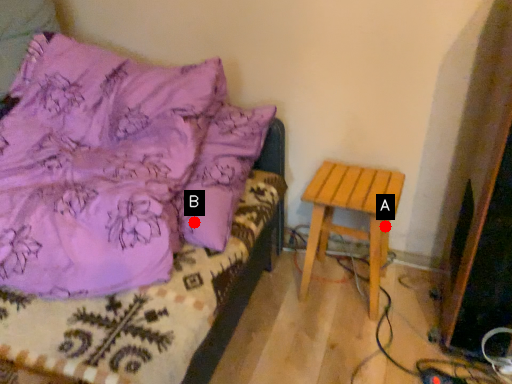
Question: Two points are circled on the image, labeled by A and B beside each circle. Which point is closer to the camera?

Choices:
 (A) A is closer
 (B) B is closer

Answer: (B)